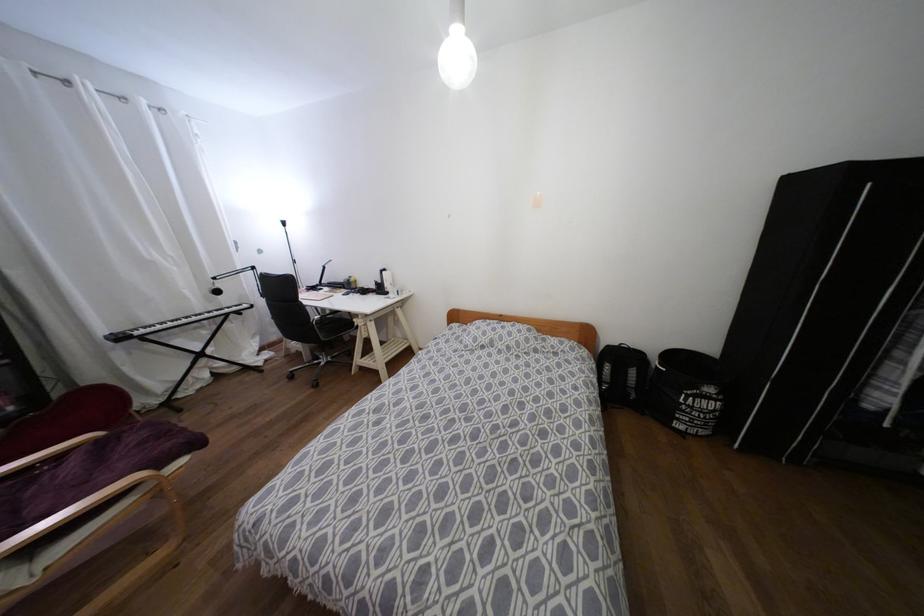
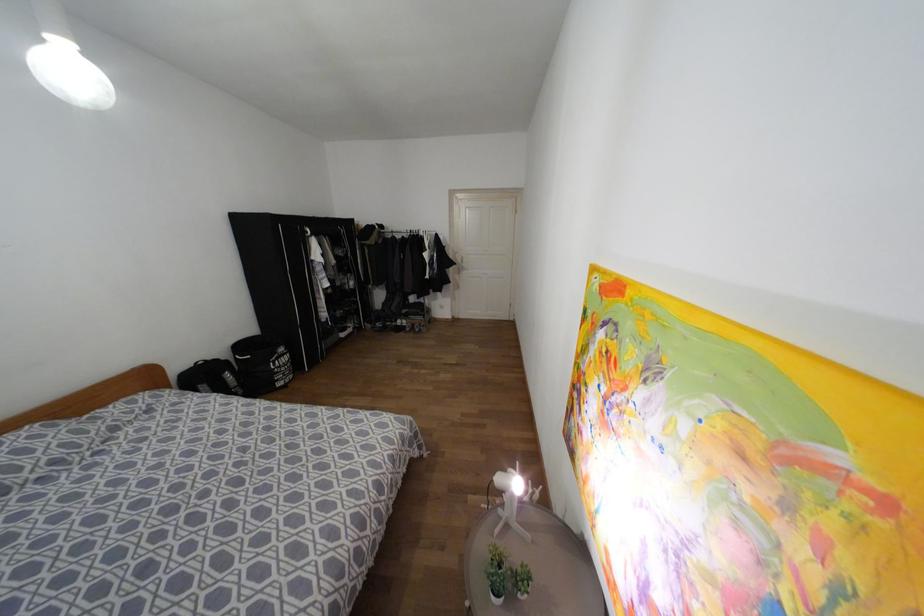
Find the pixel in the second image that matches (x=709, y=389) in the first image.

(281, 349)